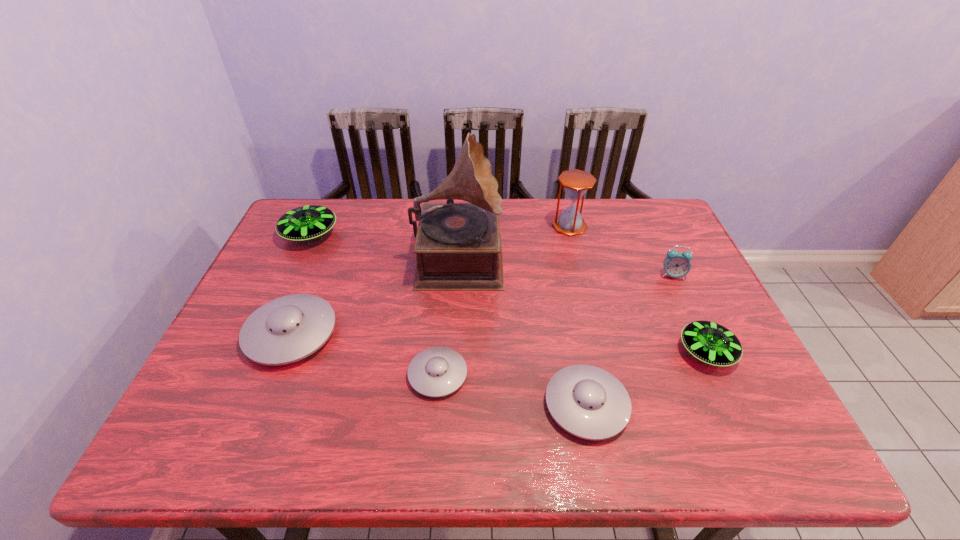
Find the location of a particular element. The image size is (960, 540). vacant region located 0.320m on the right of the shortest saucer is located at coordinates (606, 375).

I want to click on record player situated at the far edge, so click(x=458, y=245).

Locate an element on the screen. Image resolution: width=960 pixels, height=540 pixels. hourglass present at the far edge is located at coordinates (576, 182).

Image resolution: width=960 pixels, height=540 pixels. In order to click on saucer present at the far edge in this screenshot , I will do `click(305, 223)`.

Where is `object that is at the near edge`? The image size is (960, 540). object that is at the near edge is located at coordinates (588, 402).

You are a GUI agent. You are given a task and a screenshot of the screen. Output one action in this format:
    pyautogui.click(x=<x>, y=<y>)
    Task: Click on the alarm clock that is positioned at the right edge
    The width and height of the screenshot is (960, 540).
    Given the screenshot: What is the action you would take?
    pyautogui.click(x=676, y=264)

In order to click on saucer present at the right edge in this screenshot , I will do `click(709, 342)`.

Locate an element on the screen. The height and width of the screenshot is (540, 960). object at the far left corner is located at coordinates (305, 223).

Locate an element on the screen. vacant region at the far edge of the desktop is located at coordinates (357, 210).

I want to click on vacant space at the near edge, so click(x=512, y=426).